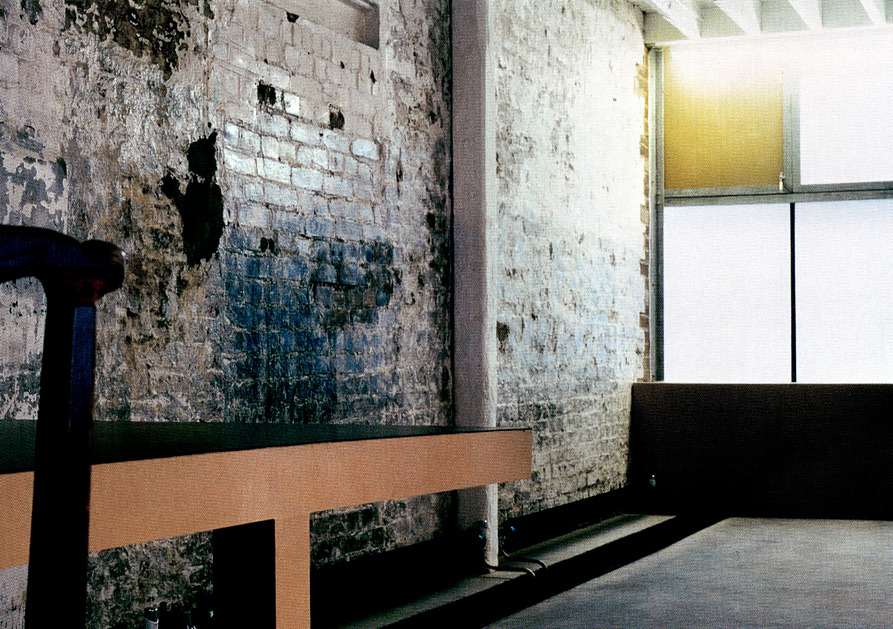
The image size is (893, 629). What are the coordinates of `surface of table` in the screenshot? It's located at (372, 433).